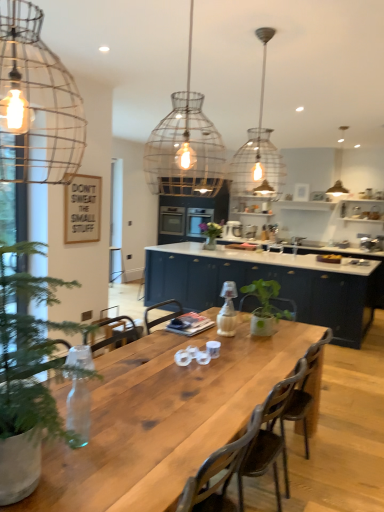
Question: Is green matte vase at center bigger or smaller than matte blue cabinets at center?

Choices:
 (A) big
 (B) small

Answer: (B)

Question: Relative to matte blue cabinets at center, is green matte vase at center in front or behind?

Choices:
 (A) front
 (B) behind

Answer: (B)

Question: Based on their relative distances, which object is farther from the wire mesh pendant light at center?

Choices:
 (A) brown wooden chair at center
 (B) matte blue cabinets at center
 (C) clear glass pendant light at upper center, marked as the 2th lamp in a front-to-back arrangement
 (D) matte glass pendant light at upper right, marked as the third lamp in a front-to-back arrangement
 (E) green matte vase at center

Answer: (A)

Question: Estimate the real-world distances between objects in this image. Which object is closer to the green matte plant at center, the first houseplant viewed from the right?

Choices:
 (A) natural wood table at center
 (B) wire mesh pendant light at upper left, placed as the first lamp when sorted from left to right
 (C) clear glass pendant light at upper center, the 2th lamp viewed from the back
 (D) matte blue cabinets at center
 (E) brown wooden chair at center

Answer: (A)